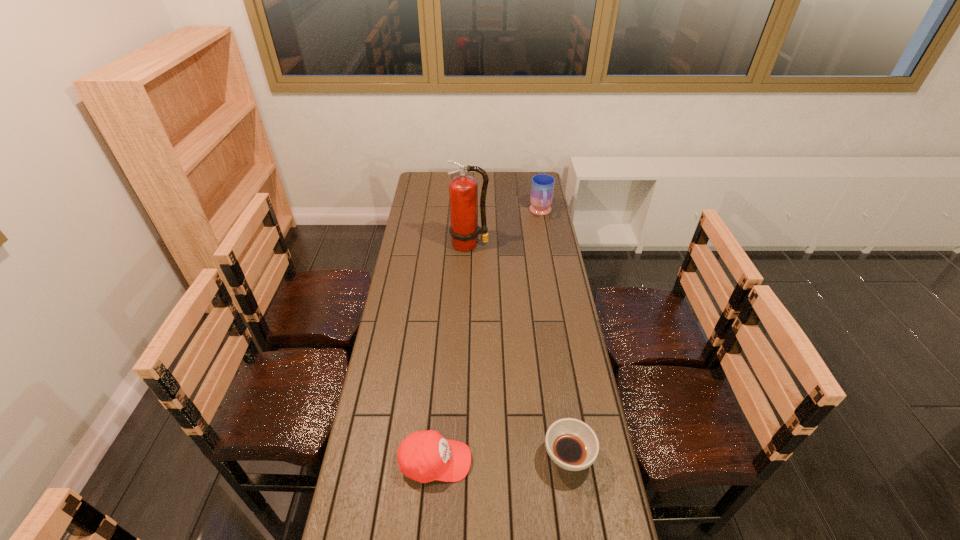
The height and width of the screenshot is (540, 960). Find the location of `object that is at the left edge`. object that is at the left edge is located at coordinates (424, 456).

Identify the location of mug at the right edge. This screenshot has width=960, height=540. (542, 187).

Where is `soup bowl that is at the right edge`? This screenshot has width=960, height=540. soup bowl that is at the right edge is located at coordinates (573, 445).

The height and width of the screenshot is (540, 960). In the image, there is a desktop. Identify the location of free space at the far edge. (510, 183).

You are a GUI agent. You are given a task and a screenshot of the screen. Output one action in this format:
    pyautogui.click(x=<x>, y=<y>)
    Task: Click on the vacant space at the left edge of the desktop
    This screenshot has height=540, width=960.
    Given the screenshot: What is the action you would take?
    pyautogui.click(x=370, y=517)

I want to click on vacant region at the right edge of the desktop, so click(551, 286).

In order to click on free space between the fire extinguisher and the soup bowl in this screenshot , I will do `click(518, 350)`.

This screenshot has width=960, height=540. I want to click on unoccupied area between the baseball cap and the third nearest object, so click(452, 353).

Find the location of a particular element. unoccupied area between the farthest object and the shortest object is located at coordinates (555, 335).

Where is `empty space between the tallest object and the baseball cap`? This screenshot has height=540, width=960. empty space between the tallest object and the baseball cap is located at coordinates [x=452, y=353].